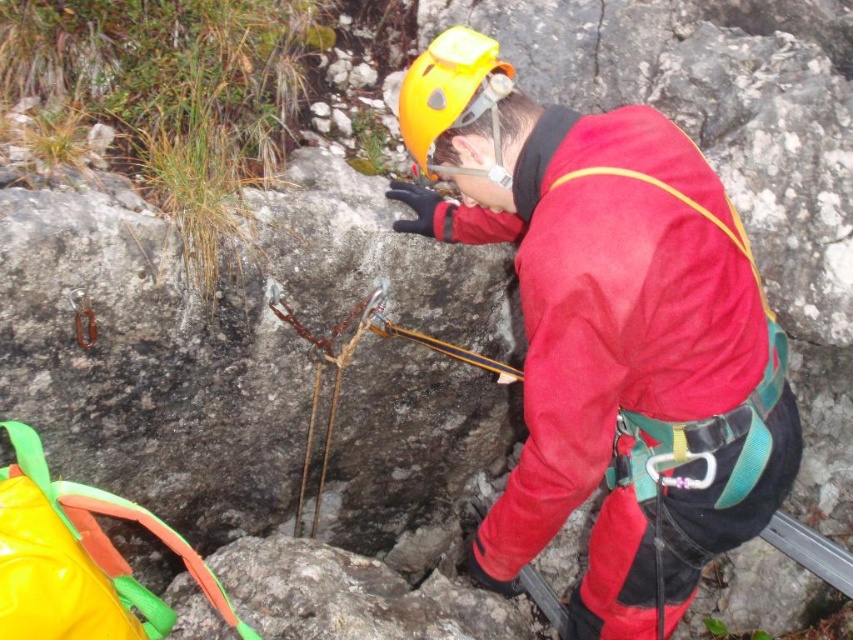
Question: Considering the relative positions of yellow fabric bag at lower left and yellow matte helmet at center in the image provided, where is yellow fabric bag at lower left located with respect to yellow matte helmet at center?

Choices:
 (A) left
 (B) right

Answer: (A)

Question: Considering the relative positions of matte red jacket at center and yellow matte helmet at center in the image provided, where is matte red jacket at center located with respect to yellow matte helmet at center?

Choices:
 (A) below
 (B) above

Answer: (A)

Question: Which point is closer to the camera?

Choices:
 (A) yellow matte helmet at center
 (B) yellow fabric bag at lower left
 (C) matte red jacket at center

Answer: (B)

Question: Which of the following is the farthest from the observer?

Choices:
 (A) yellow matte helmet at center
 (B) yellow fabric bag at lower left

Answer: (A)

Question: Among these objects, which one is nearest to the camera?

Choices:
 (A) yellow fabric bag at lower left
 (B) yellow matte helmet at center
 (C) matte red jacket at center

Answer: (A)

Question: Is matte red jacket at center positioned behind yellow fabric bag at lower left?

Choices:
 (A) yes
 (B) no

Answer: (A)